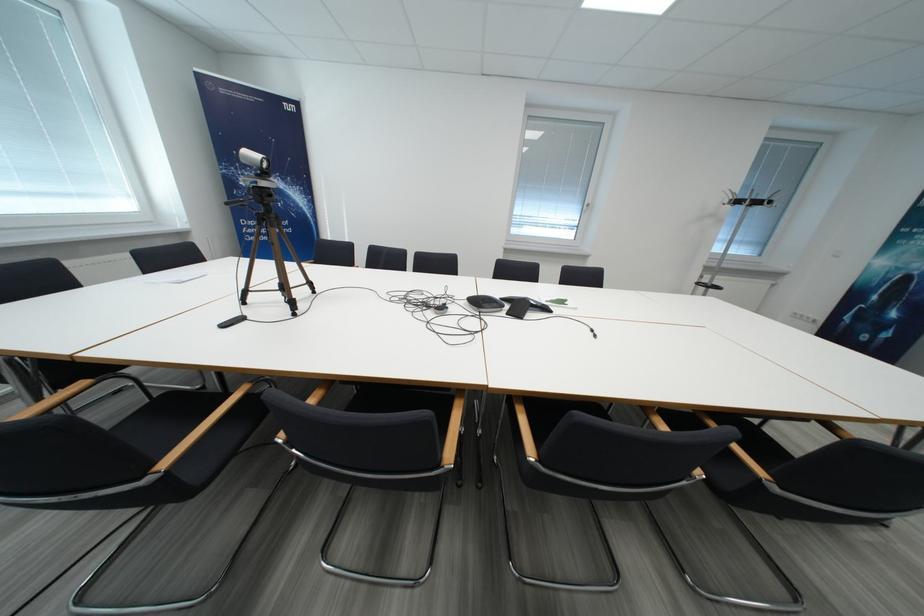
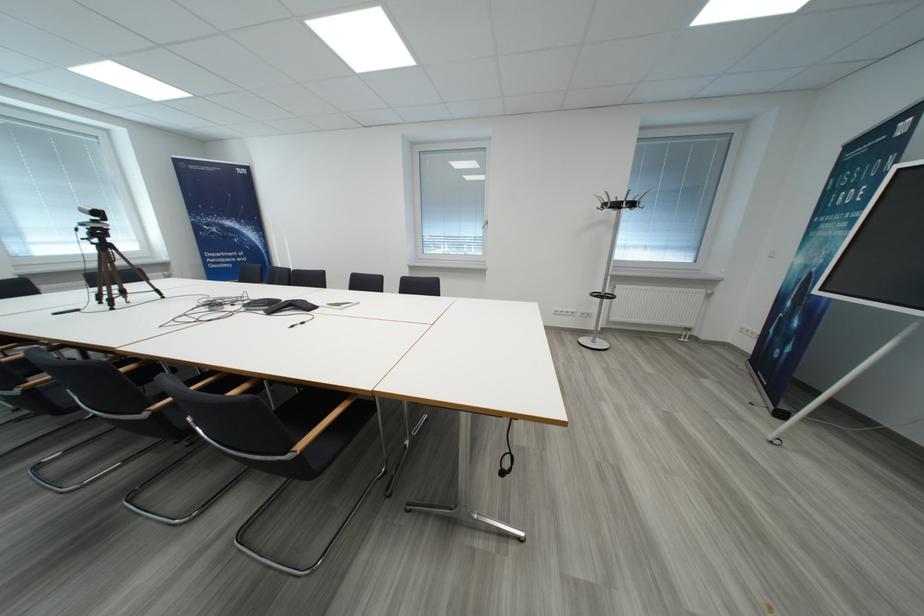
The point at (891, 265) is marked in the first image. Where is the corresponding point in the second image?

(807, 264)